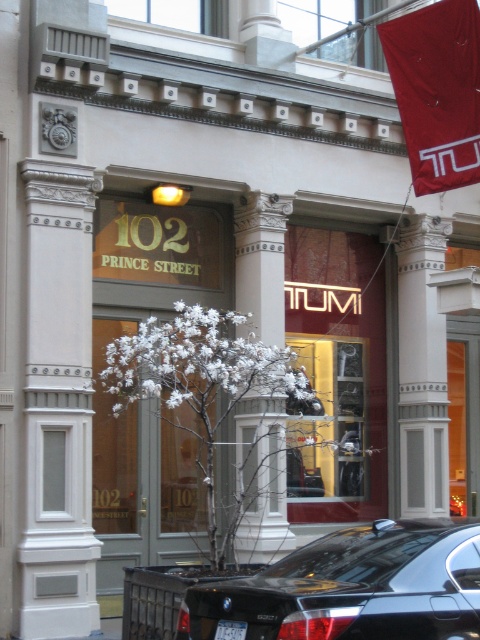
Is red fabric flag at upper right smaller than white marble column at center?

Actually, red fabric flag at upper right might be larger than white marble column at center.

Who is positioned more to the left, red fabric flag at upper right or white marble column at center?

Positioned to the left is red fabric flag at upper right.

Which is behind, point (453, 12) or point (419, 486)?

Positioned behind is point (419, 486).

Image resolution: width=480 pixels, height=640 pixels. What are the coordinates of `red fabric flag at upper right` in the screenshot? It's located at (436, 90).

Between black glossy car at lower center and white marble column at center, which one is positioned higher?

white marble column at center is above.

Who is shorter, black glossy car at lower center or white marble column at center?

black glossy car at lower center is shorter.

Between point (357, 637) and point (399, 444), which one is positioned behind?

Positioned behind is point (399, 444).

Locate an element on the screen. This screenshot has height=640, width=480. black glossy car at lower center is located at coordinates (352, 588).

Who is lower down, red fabric flag at upper right or white plastic license plate at lower center?

Positioned lower is white plastic license plate at lower center.

Is point (460, 108) positioned in front of point (224, 634)?

That is False.

The width and height of the screenshot is (480, 640). What do you see at coordinates (436, 90) in the screenshot?
I see `red fabric flag at upper right` at bounding box center [436, 90].

Where is `red fabric flag at upper right`? The height and width of the screenshot is (640, 480). red fabric flag at upper right is located at coordinates (436, 90).